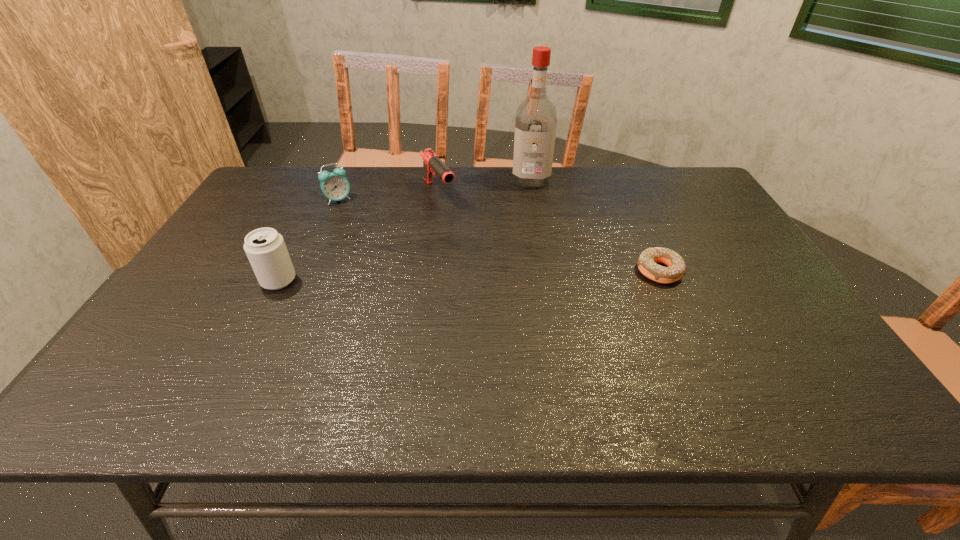
What are the coordinates of `vacant space that is in between the rightmost object and the can` in the screenshot? It's located at (468, 276).

This screenshot has height=540, width=960. I want to click on vacant region between the alarm clock and the shortest object, so click(x=499, y=235).

At what (x,y) coordinates should I click in order to perform the action: click on empty location between the alarm clock and the can. Please return your answer as a coordinate pair (x, y). Looking at the image, I should click on (308, 240).

Find the location of a particular element. free space between the shortest object and the tallest object is located at coordinates [595, 226].

You are a GUI agent. You are given a task and a screenshot of the screen. Output one action in this format:
    pyautogui.click(x=<x>, y=<y>)
    Task: Click on the vacant space that's between the can and the liquor
    
    Given the screenshot: What is the action you would take?
    pyautogui.click(x=405, y=230)

Identify the location of empty space that is in between the can and the liquor. Image resolution: width=960 pixels, height=540 pixels. pyautogui.click(x=405, y=230).

Image resolution: width=960 pixels, height=540 pixels. In order to click on free space between the third object from left to right and the alarm clock in this screenshot , I will do `click(389, 196)`.

Locate which object is the third closest to the alarm clock. Please provide its 2D coordinates. Your answer should be formatted as a tuple, i.e. [(x, y)], where the tuple contains the x and y coordinates of a point satisfying the conditions above.

[(536, 118)]

Select which object is the closest to the can. Please provide its 2D coordinates. Your answer should be formatted as a tuple, i.e. [(x, y)], where the tuple contains the x and y coordinates of a point satisfying the conditions above.

[(334, 185)]

Where is `free space that satisfies the following two spatial constraints: 1. on the back side of the gun; 2. on the right side of the fourth object from left to right`? free space that satisfies the following two spatial constraints: 1. on the back side of the gun; 2. on the right side of the fourth object from left to right is located at coordinates (440, 180).